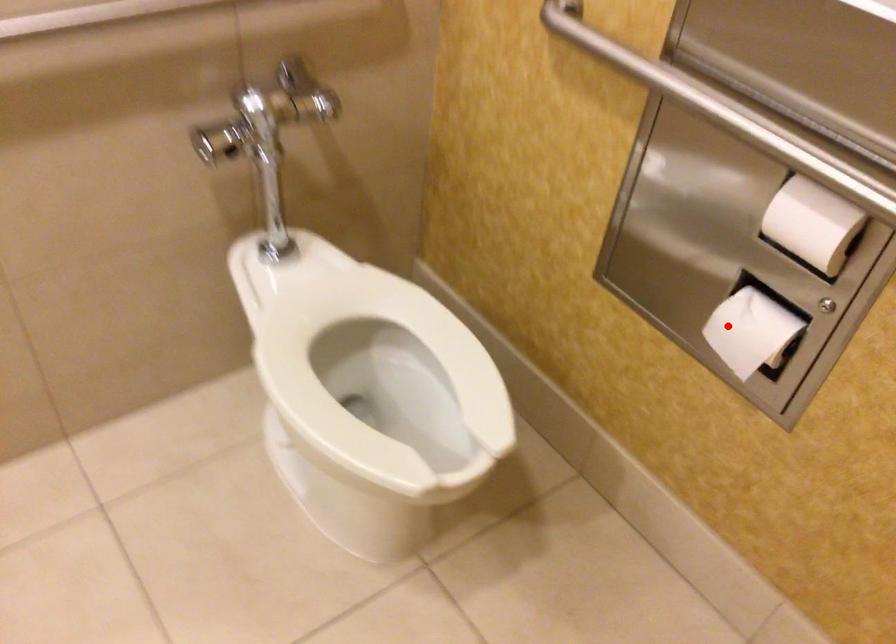
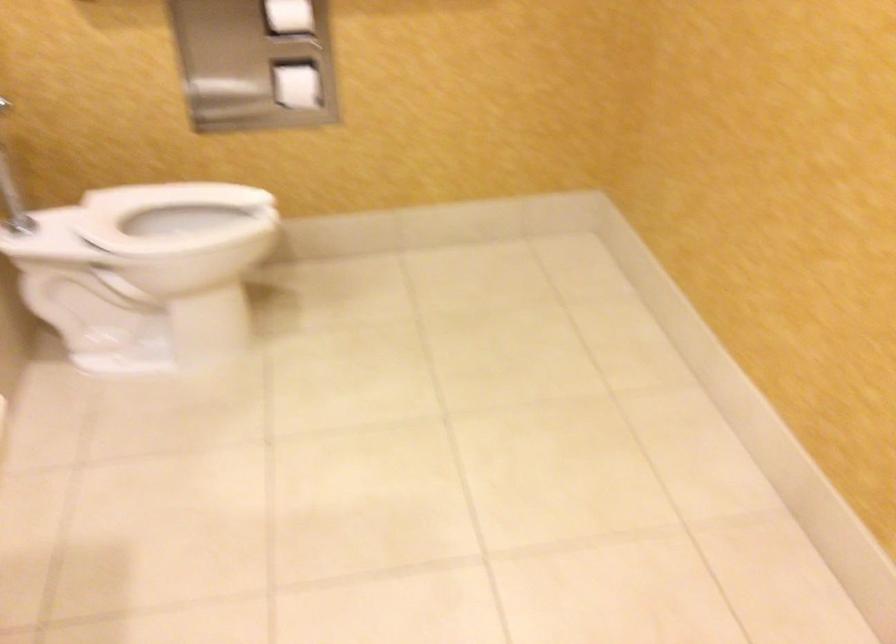
Where in the second image is the point corresponding to the highlighted location from the first image?

(297, 86)